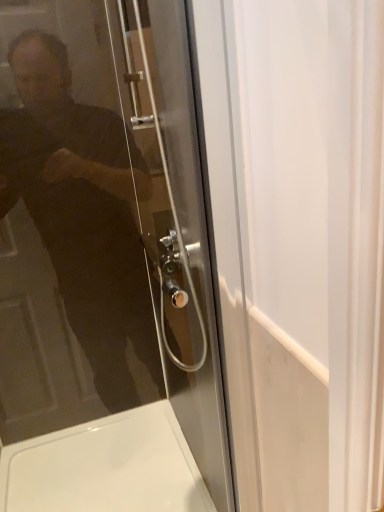
Question: From a real-world perspective, is transparent glass door at upper left located beneath white glossy bath at lower left?

Choices:
 (A) yes
 (B) no

Answer: (B)

Question: From the image's perspective, would you say transparent glass door at upper left is positioned over white glossy bath at lower left?

Choices:
 (A) yes
 (B) no

Answer: (A)

Question: Is transparent glass door at upper left positioned far away from white glossy bath at lower left?

Choices:
 (A) yes
 (B) no

Answer: (B)

Question: Considering the relative positions of transparent glass door at upper left and white glossy bath at lower left in the image provided, is transparent glass door at upper left to the left of white glossy bath at lower left from the viewer's perspective?

Choices:
 (A) no
 (B) yes

Answer: (A)

Question: Considering the relative positions of transparent glass door at upper left and white glossy bath at lower left in the image provided, is transparent glass door at upper left in front of white glossy bath at lower left?

Choices:
 (A) yes
 (B) no

Answer: (A)

Question: Is white glossy bath at lower left surrounded by transparent glass door at upper left?

Choices:
 (A) no
 (B) yes

Answer: (A)

Question: Is white glossy bath at lower left with transparent glass door at upper left?

Choices:
 (A) no
 (B) yes

Answer: (A)

Question: Can you confirm if white glossy bath at lower left is taller than transparent glass door at upper left?

Choices:
 (A) no
 (B) yes

Answer: (A)

Question: Does white glossy bath at lower left appear on the right side of transparent glass door at upper left?

Choices:
 (A) no
 (B) yes

Answer: (A)

Question: Would you consider white glossy bath at lower left to be distant from transparent glass door at upper left?

Choices:
 (A) no
 (B) yes

Answer: (A)

Question: Considering the relative sizes of white glossy bath at lower left and transparent glass door at upper left in the image provided, is white glossy bath at lower left wider than transparent glass door at upper left?

Choices:
 (A) no
 (B) yes

Answer: (B)

Question: Does white glossy bath at lower left come behind transparent glass door at upper left?

Choices:
 (A) no
 (B) yes

Answer: (B)

Question: Choose the correct answer: Is white glossy bath at lower left inside transparent glass door at upper left or outside it?

Choices:
 (A) inside
 (B) outside

Answer: (B)